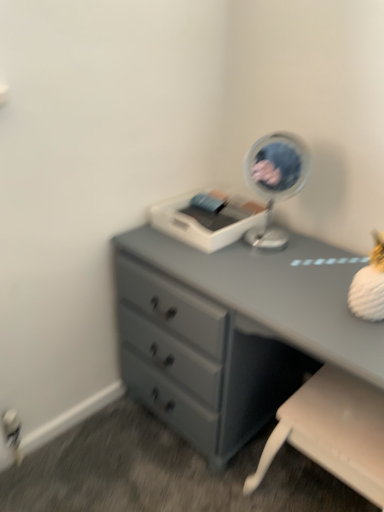
You are a GUI agent. You are given a task and a screenshot of the screen. Output one action in this format:
    pyautogui.click(x=<x>, y=<y>)
    Task: Click on the vacant area that is in front of white plastic printer at center
    This screenshot has height=512, width=384.
    Given the screenshot: What is the action you would take?
    pyautogui.click(x=228, y=263)